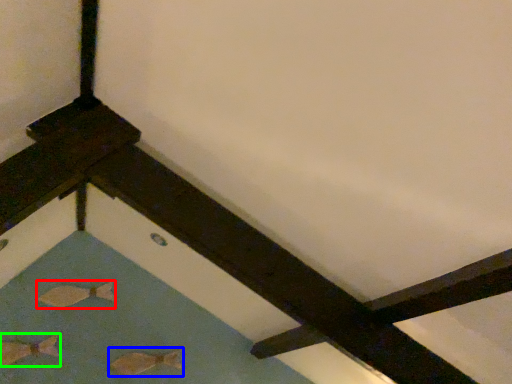
Question: Which object is the farthest from fish (highlighted by a red box)? Choose among these: fish (highlighted by a blue box) or fish (highlighted by a green box).

Choices:
 (A) fish
 (B) fish

Answer: (A)